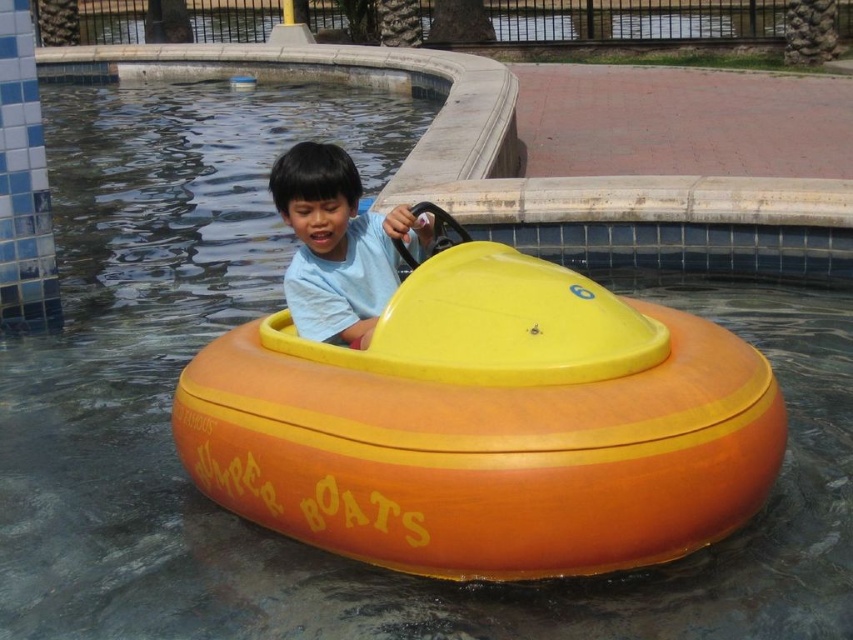
Between orange matte bumper boat at center and matte yellow bumper boat at center, which one has less height?

matte yellow bumper boat at center

Is orange matte bumper boat at center smaller than matte yellow bumper boat at center?

No, orange matte bumper boat at center is not smaller than matte yellow bumper boat at center.

Which is behind, point (437, 529) or point (294, 284)?

Point (294, 284)

The height and width of the screenshot is (640, 853). Find the location of `orange matte bumper boat at center`. orange matte bumper boat at center is located at coordinates (488, 426).